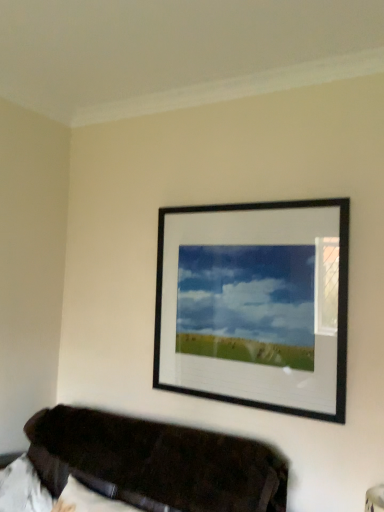
Describe the element at coordinates (255, 305) in the screenshot. I see `black matte picture frame at upper center` at that location.

I want to click on black matte picture frame at upper center, so [x=255, y=305].

Locate an element on the screen. This screenshot has height=512, width=384. black matte picture frame at upper center is located at coordinates (255, 305).